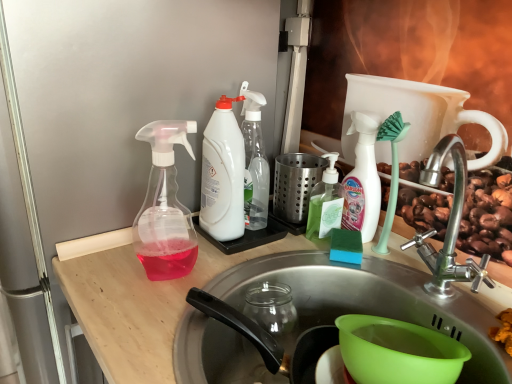
Question: Should I look upward or downward to see transparent plastic spray bottle at left, acting as the 5th bottle starting from the right?

Choices:
 (A) down
 (B) up

Answer: (A)

Question: Which direction should I rotate to face white matte bottle at center, marked as the 1th bottle in a right-to-left arrangement, — up or down?

Choices:
 (A) up
 (B) down

Answer: (A)

Question: From the image's perspective, is white matte bottle at center, positioned as the fifth bottle in left-to-right order, below white plastic spray bottle at center, which is counted as the 3th bottle, starting from the right?

Choices:
 (A) yes
 (B) no

Answer: (A)

Question: Is white matte bottle at center, positioned as the fifth bottle in left-to-right order, facing away from white plastic spray bottle at center, which is the 3th bottle from left to right?

Choices:
 (A) no
 (B) yes

Answer: (A)

Question: Considering the relative sizes of white matte bottle at center, marked as the 1th bottle in a right-to-left arrangement, and white plastic spray bottle at center, which is the 3th bottle from left to right, in the image provided, is white matte bottle at center, marked as the 1th bottle in a right-to-left arrangement, bigger than white plastic spray bottle at center, which is the 3th bottle from left to right,?

Choices:
 (A) yes
 (B) no

Answer: (B)

Question: Considering the relative sizes of white matte bottle at center, marked as the 1th bottle in a right-to-left arrangement, and white plastic spray bottle at center, which is counted as the 3th bottle, starting from the right, in the image provided, is white matte bottle at center, marked as the 1th bottle in a right-to-left arrangement, taller than white plastic spray bottle at center, which is counted as the 3th bottle, starting from the right,?

Choices:
 (A) no
 (B) yes

Answer: (A)

Question: Considering the relative sizes of white matte bottle at center, marked as the 1th bottle in a right-to-left arrangement, and white plastic spray bottle at center, which is the 3th bottle from left to right, in the image provided, is white matte bottle at center, marked as the 1th bottle in a right-to-left arrangement, thinner than white plastic spray bottle at center, which is the 3th bottle from left to right,?

Choices:
 (A) no
 (B) yes

Answer: (B)

Question: Is white matte bottle at center, positioned as the fifth bottle in left-to-right order, with white plastic spray bottle at center, which is counted as the 3th bottle, starting from the right?

Choices:
 (A) yes
 (B) no

Answer: (B)

Question: Considering the relative sizes of green translucent soap dispenser at center, which is the fourth bottle in left-to-right order, and white matte bottle at center, positioned as the fifth bottle in left-to-right order, in the image provided, is green translucent soap dispenser at center, which is the fourth bottle in left-to-right order, bigger than white matte bottle at center, positioned as the fifth bottle in left-to-right order,?

Choices:
 (A) no
 (B) yes

Answer: (A)

Question: Is the position of green translucent soap dispenser at center, which is the 2th bottle in right-to-left order, less distant than that of white matte bottle at center, marked as the 1th bottle in a right-to-left arrangement?

Choices:
 (A) yes
 (B) no

Answer: (B)

Question: Is green translucent soap dispenser at center, which is the fourth bottle in left-to-right order, smaller than white matte bottle at center, positioned as the fifth bottle in left-to-right order?

Choices:
 (A) no
 (B) yes

Answer: (B)

Question: Does green translucent soap dispenser at center, which is the 2th bottle in right-to-left order, have a lesser width compared to white matte bottle at center, positioned as the fifth bottle in left-to-right order?

Choices:
 (A) no
 (B) yes

Answer: (A)

Question: Does green translucent soap dispenser at center, which is the fourth bottle in left-to-right order, appear on the right side of white matte bottle at center, positioned as the fifth bottle in left-to-right order?

Choices:
 (A) yes
 (B) no

Answer: (B)

Question: Is green translucent soap dispenser at center, which is the fourth bottle in left-to-right order, directly adjacent to white matte bottle at center, positioned as the fifth bottle in left-to-right order?

Choices:
 (A) no
 (B) yes

Answer: (B)

Question: Would you say white plastic bottle at center, arranged as the 2th bottle when viewed from the left, is outside transparent plastic spray bottle at left, the first bottle when ordered from left to right?

Choices:
 (A) yes
 (B) no

Answer: (A)